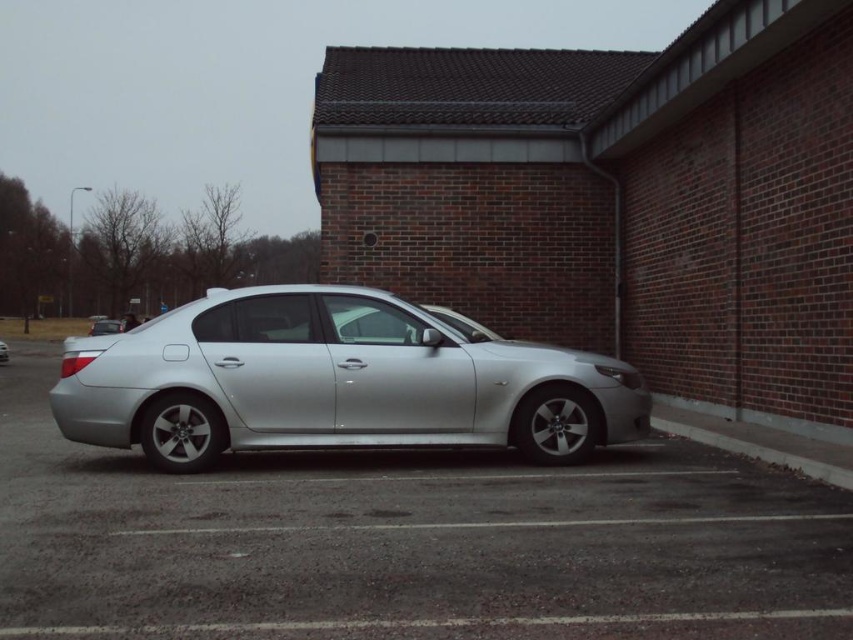
Question: Estimate the real-world distances between objects in this image. Which object is farther from the gray concrete curb at lower right?

Choices:
 (A) satin silver car at center
 (B) silver metallic car at center

Answer: (A)

Question: In this image, where is silver metallic car at center located relative to gray concrete curb at lower right?

Choices:
 (A) left
 (B) right

Answer: (A)

Question: Can you confirm if satin silver car at center is positioned below gray concrete curb at lower right?

Choices:
 (A) yes
 (B) no

Answer: (B)

Question: Which object is positioned farthest from the gray concrete curb at lower right?

Choices:
 (A) satin silver car at center
 (B) silver metallic car at center

Answer: (A)

Question: Which of the following is the farthest from the observer?

Choices:
 (A) gray concrete curb at lower right
 (B) silver metallic car at center

Answer: (A)

Question: Does satin silver car at center appear under gray concrete curb at lower right?

Choices:
 (A) yes
 (B) no

Answer: (B)